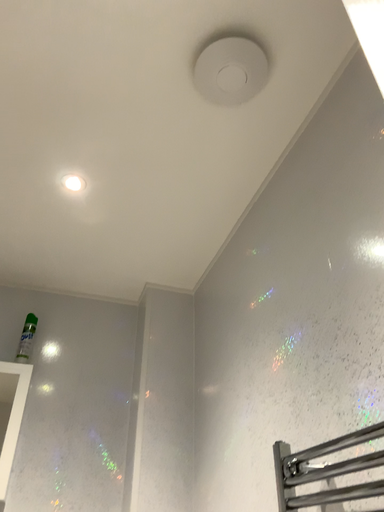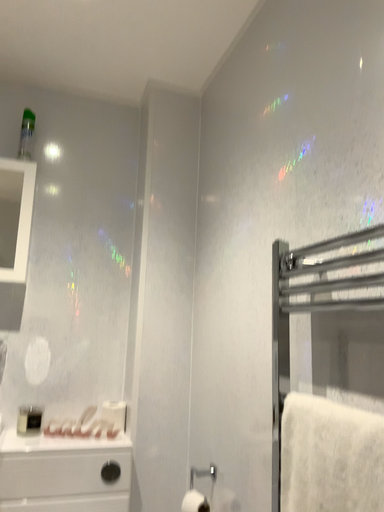
Question: How did the camera likely rotate when shooting the video?

Choices:
 (A) rotated downward
 (B) rotated upward

Answer: (A)